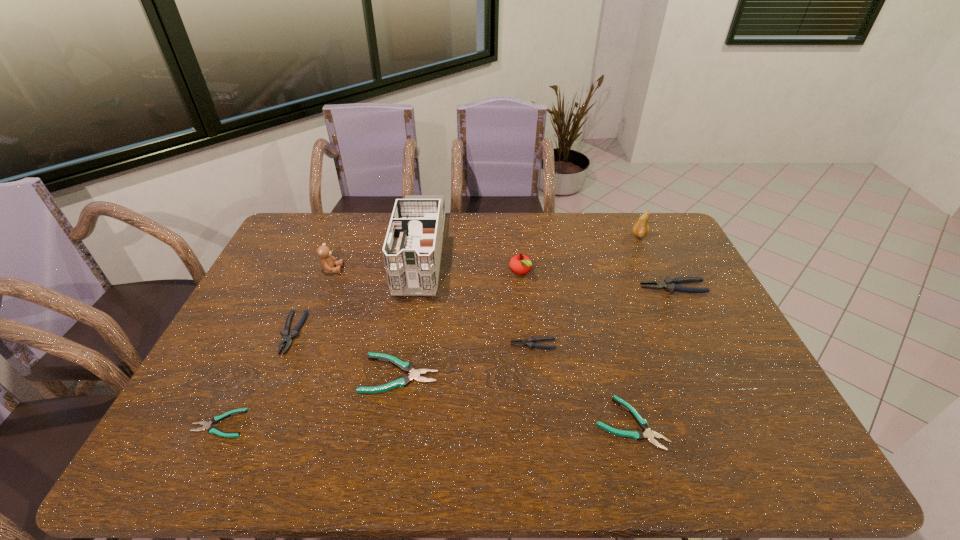
Image resolution: width=960 pixels, height=540 pixels. Identify the location of vacant space situated 0.050m on the right of the smallest teal pliers. (267, 423).

You are a GUI agent. You are given a task and a screenshot of the screen. Output one action in this format:
    pyautogui.click(x=<x>, y=<y>)
    Task: Click on the dollhouse present at the far edge
    This screenshot has width=960, height=540.
    Given the screenshot: What is the action you would take?
    pyautogui.click(x=412, y=249)

Find the location of a particular element. pear that is at the far edge is located at coordinates (640, 229).

Locate an element on the screen. The width and height of the screenshot is (960, 540). pear that is positioned at the right edge is located at coordinates (640, 229).

Identify the location of pliers present at the right edge. This screenshot has width=960, height=540. (669, 284).

You are a GUI agent. You are given a task and a screenshot of the screen. Output one action in this format:
    pyautogui.click(x=<x>, y=<y>)
    Task: Click on the object situated at the near left corner
    The width and height of the screenshot is (960, 540).
    Given the screenshot: What is the action you would take?
    pyautogui.click(x=206, y=425)

Find the location of a particular element. object present at the far right corner is located at coordinates (640, 229).

In the image, there is a desktop. Where is `vacant area at the far edge`? The height and width of the screenshot is (540, 960). vacant area at the far edge is located at coordinates (334, 244).

At what (x,y) coordinates should I click in order to perform the action: click on blank space at the near edge of the desktop. Please return your answer as a coordinate pair (x, y). Looking at the image, I should click on (646, 450).

At what (x,y) coordinates should I click in order to perform the action: click on free space at the left edge of the desktop. Please return your answer as a coordinate pair (x, y). Looking at the image, I should click on (252, 354).